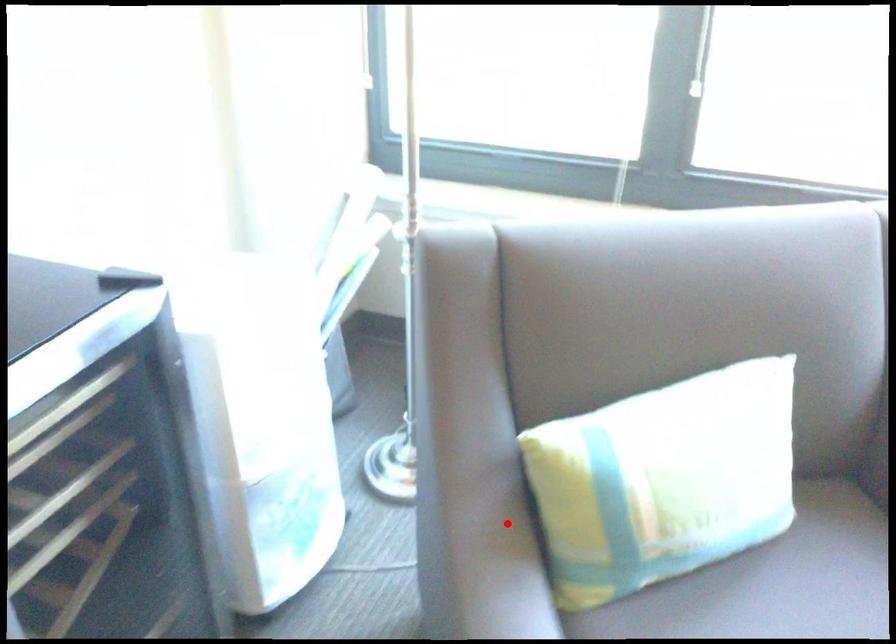
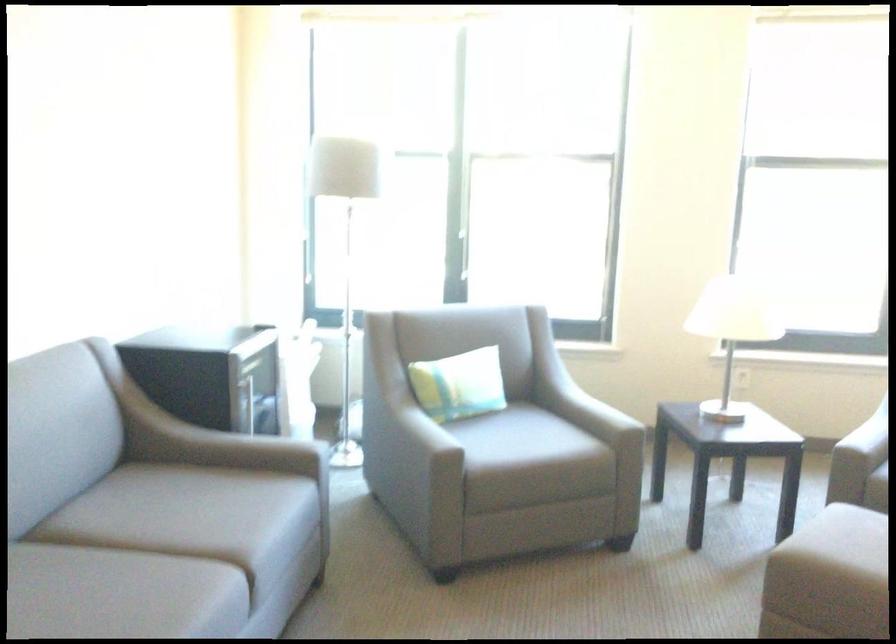
The point at the highlighted location is marked in the first image. Where is the corresponding point in the second image?

(356, 420)